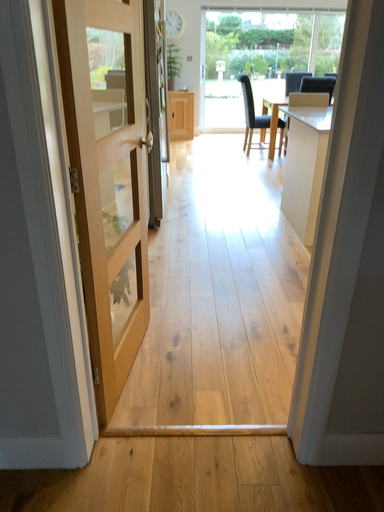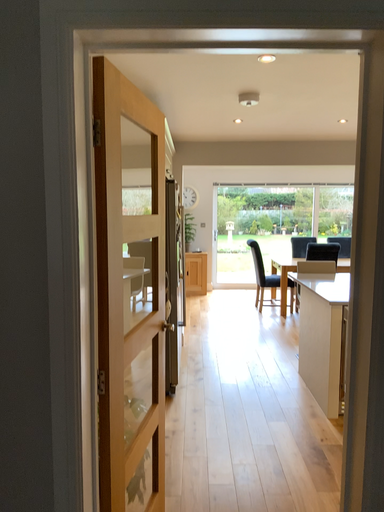
Question: Which way did the camera rotate in the video?

Choices:
 (A) rotated upward
 (B) rotated downward

Answer: (A)